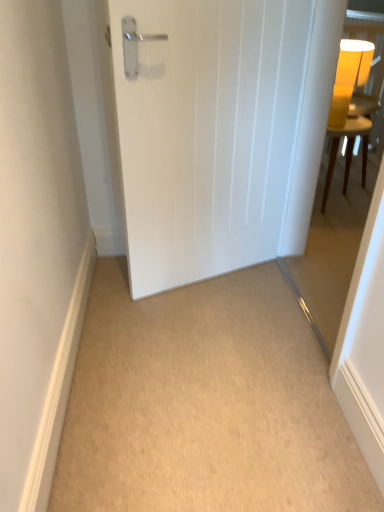
Question: Is white matte door at center in front of or behind beige carpet at center in the image?

Choices:
 (A) front
 (B) behind

Answer: (B)

Question: Is point (206, 248) closer or farther from the camera than point (261, 282)?

Choices:
 (A) farther
 (B) closer

Answer: (B)

Question: Which object is the closest to the beige carpet at center?

Choices:
 (A) yellow matte table lamp at upper right
 (B) white matte door at center
 (C) transparent glass door at right
 (D) yellow wood table at upper right

Answer: (C)

Question: Estimate the real-world distances between objects in this image. Which object is farther from the yellow matte table lamp at upper right?

Choices:
 (A) yellow wood table at upper right
 (B) white matte door at center
 (C) beige carpet at center
 (D) transparent glass door at right

Answer: (C)